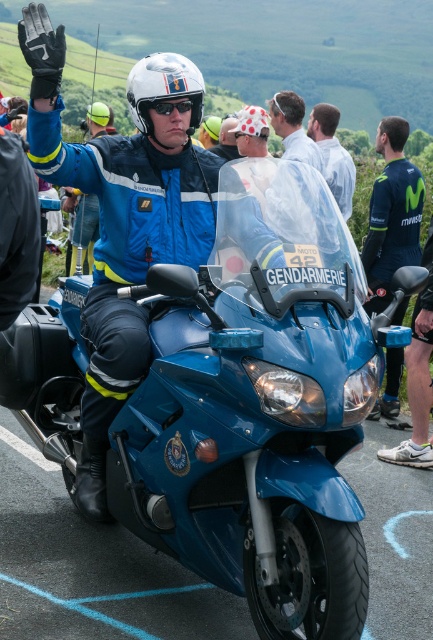
Which is more to the right, white matte helmet at center or white cotton shirt at upper center?

white cotton shirt at upper center is more to the right.

Based on the photo, is white matte helmet at center shorter than white cotton shirt at upper center?

Indeed, white matte helmet at center has a lesser height compared to white cotton shirt at upper center.

Is point (165, 93) behind point (317, 154)?

No, (165, 93) is closer to viewer.

Find the location of a particular element. white matte helmet at center is located at coordinates (164, 88).

This screenshot has width=433, height=640. Describe the element at coordinates (391, 214) in the screenshot. I see `blue jersey at center` at that location.

Does blue jersey at center appear over white matte helmet at center?

Incorrect, blue jersey at center is not positioned above white matte helmet at center.

Identify the location of blue jersey at center. (391, 214).

Does blue glossy motorcycle at center have a larger size compared to blue jersey at center?

Indeed, blue glossy motorcycle at center has a larger size compared to blue jersey at center.

Which is behind, point (274, 616) or point (423, 198)?

The point (423, 198) is more distant.

Who is more distant from viewer, (239,387) or (400,308)?

Positioned behind is point (400,308).

I want to click on blue glossy motorcycle at center, so click(x=258, y=429).